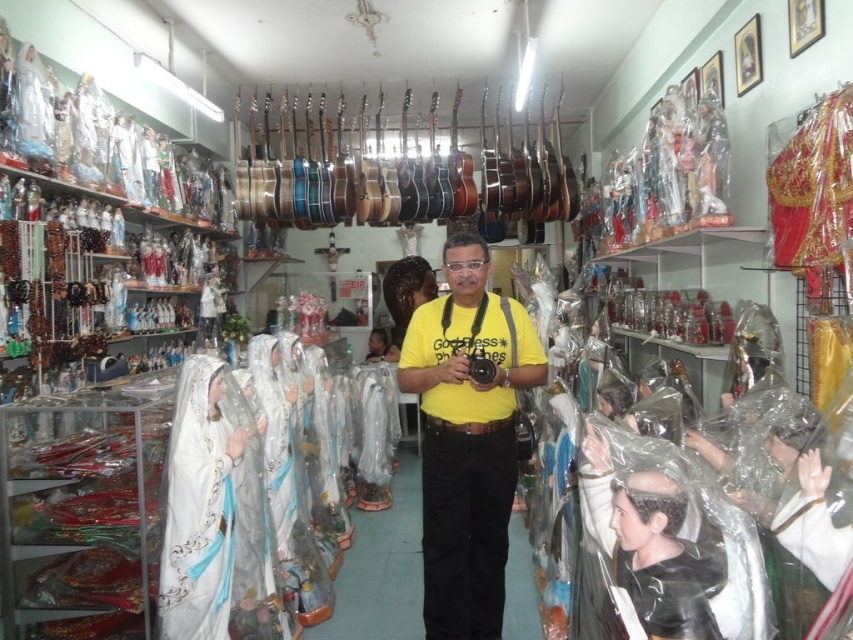
You are standing in the shop and want to pick up an item located at point (486,448). Can you reach it without moving your feet?

The point (486,448) is 8.32 feet away from you, so you can reach it without moving your feet.